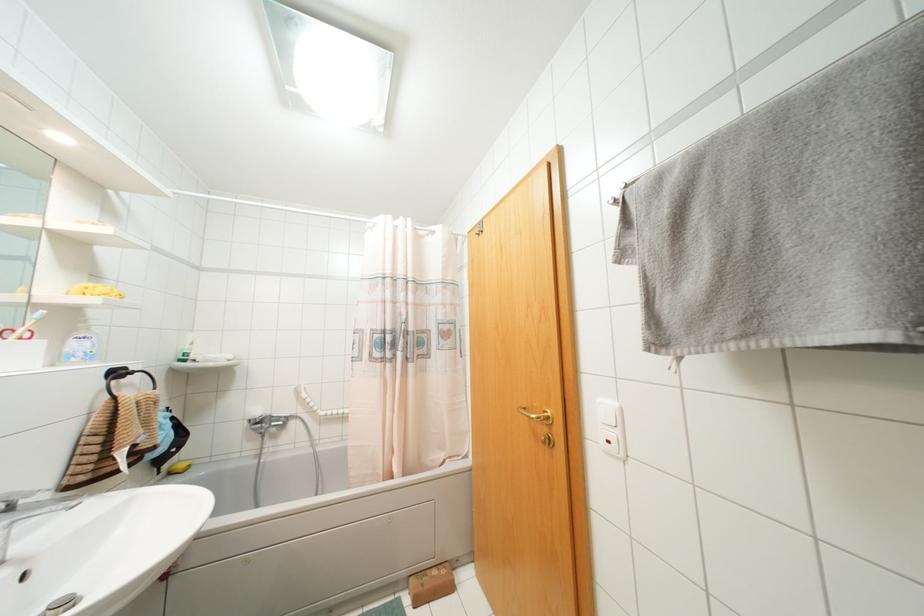
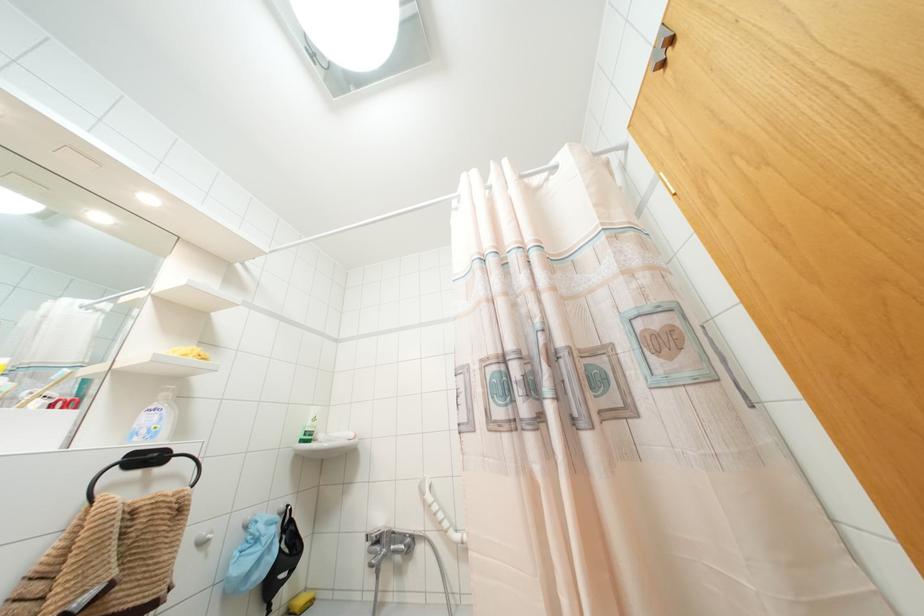
Where in the second image is the point corresponding to the point at 190,342 from the first image?

(312, 419)